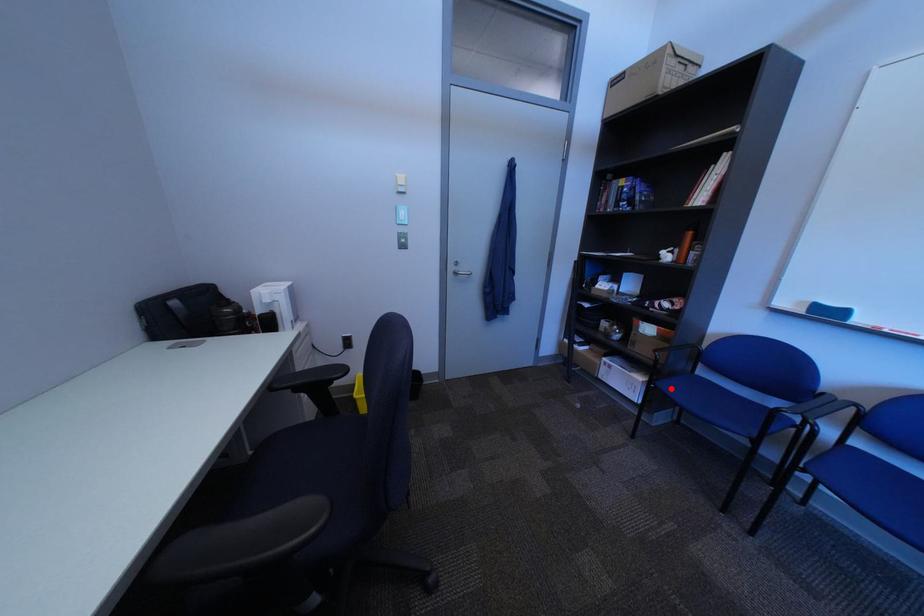
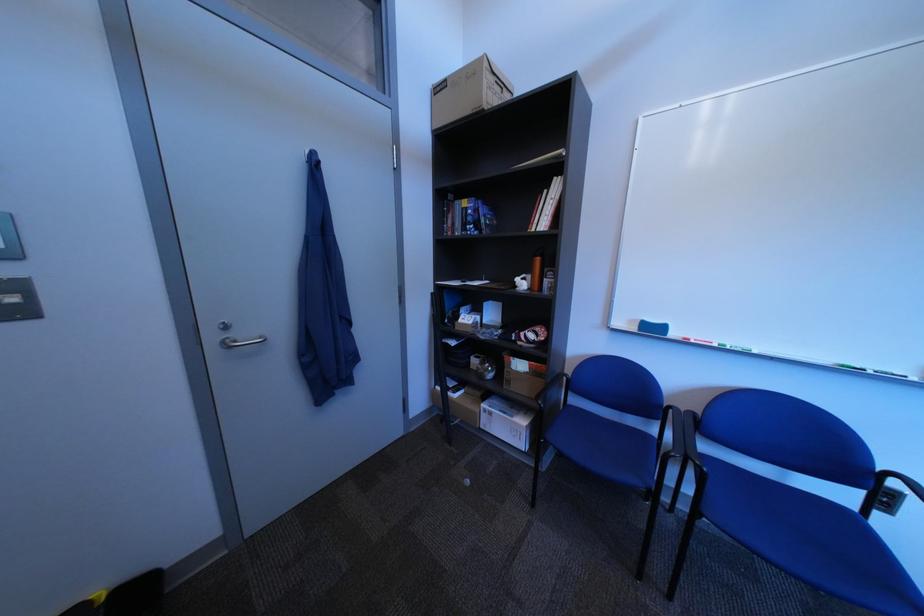
Question: I am providing you with two images of the same scene from different viewpoints. A red point is marked on the first image. At the location where the point appears in image 1, is it still visible in image 2?

Choices:
 (A) Yes
 (B) No

Answer: (A)